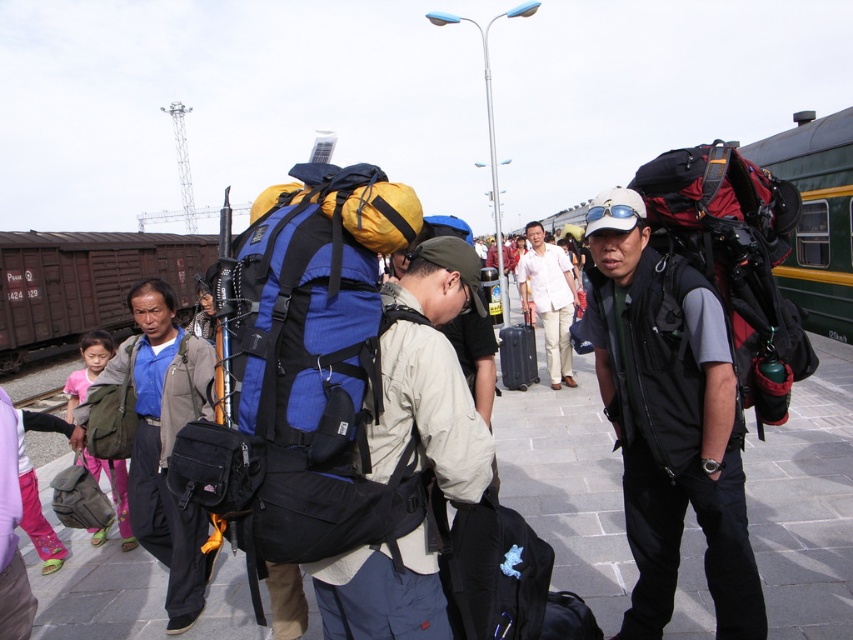
Does blue fabric backpack at center have a lesser width compared to matte black backpack at center?

Indeed, blue fabric backpack at center has a lesser width compared to matte black backpack at center.

Who is taller, blue fabric backpack at center or matte black backpack at center?

With more height is matte black backpack at center.

You are a GUI agent. You are given a task and a screenshot of the screen. Output one action in this format:
    pyautogui.click(x=<x>, y=<y>)
    Task: Click on the blue fabric backpack at center
    The width and height of the screenshot is (853, 640).
    Given the screenshot: What is the action you would take?
    pyautogui.click(x=300, y=371)

Locate an element on the screen. The height and width of the screenshot is (640, 853). blue fabric backpack at center is located at coordinates (300, 371).

Is point (798, 372) positioned before point (134, 516)?

Yes, point (798, 372) is closer to viewer.

Does matte black backpack at right lie in front of matte black bag at left?

Yes, it is in front of matte black bag at left.

Does point (782, 300) come in front of point (163, 483)?

Yes, point (782, 300) is in front of point (163, 483).

Find the location of `matte black backpack at right`. matte black backpack at right is located at coordinates (735, 259).

Is matte green backpack at left bigger than metal train track at lower left?

Actually, matte green backpack at left might be smaller than metal train track at lower left.

Is point (86, 368) positioned after point (39, 403)?

No, it is in front of (39, 403).

Does point (88, 353) come closer to viewer compared to point (16, 406)?

Yes, point (88, 353) is in front of point (16, 406).

The height and width of the screenshot is (640, 853). What are the coordinates of `matte green backpack at left` in the screenshot? It's located at (86, 369).